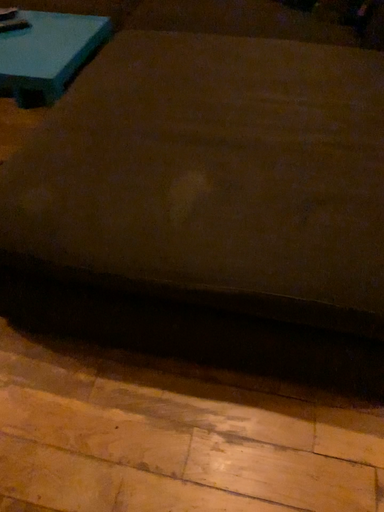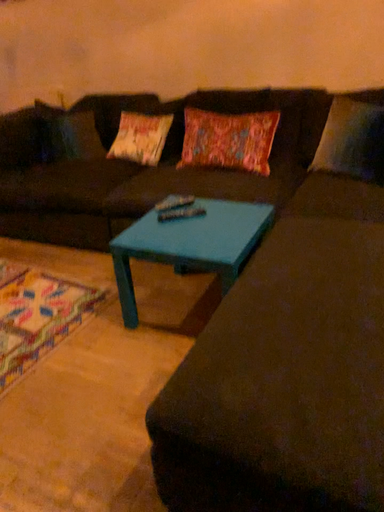
Question: How did the camera likely rotate when shooting the video?

Choices:
 (A) rotated left
 (B) rotated right

Answer: (A)